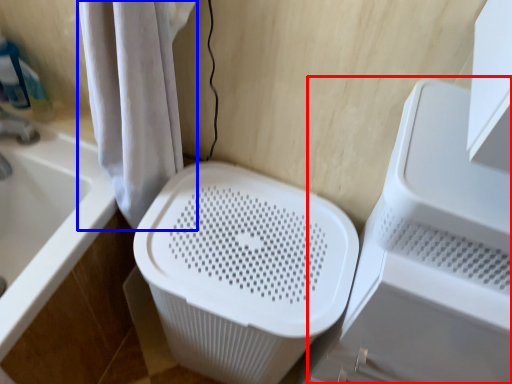
Question: Which object is further to the camera taking this photo, appliance (highlighted by a red box) or shower curtain (highlighted by a blue box)?

Choices:
 (A) appliance
 (B) shower curtain

Answer: (A)